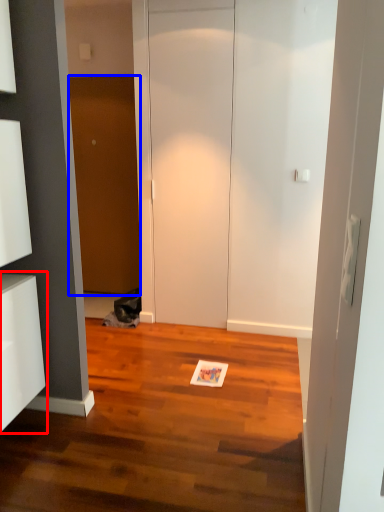
Question: Among these objects, which one is farthest to the camera, cabinetry (highlighted by a red box) or door (highlighted by a blue box)?

Choices:
 (A) cabinetry
 (B) door

Answer: (B)